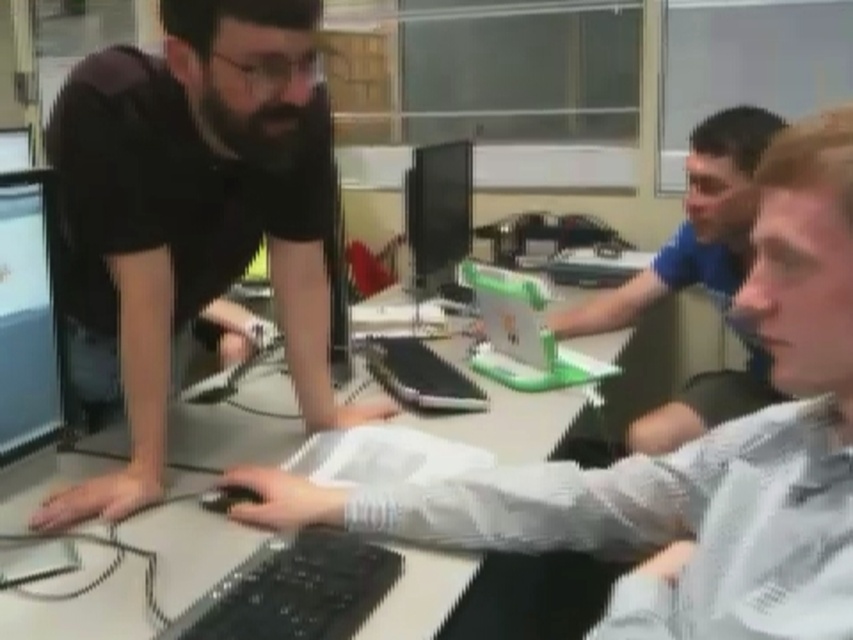
You are organizing a meeting in this office and need to place a large presentation folder on the white glossy table at center and the matte black monitor at center. Which surface can accommodate the folder without it overlapping the edges?

The white glossy table at center has a larger size compared to the matte black monitor at center, so the folder can be placed on the white glossy table at center without overlapping the edges.